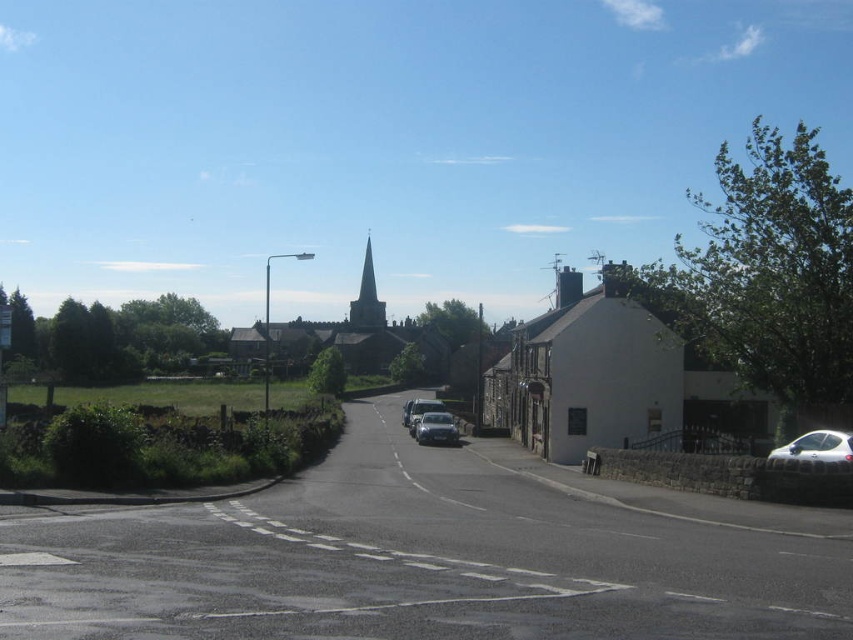
Question: Which of the following is the closest to the observer?

Choices:
 (A) white stone church at center
 (B) gray stone church steeple at center
 (C) white stone spire at center
 (D) white glossy car at lower right

Answer: (D)

Question: Which of the following is the farthest from the observer?

Choices:
 (A) (839, 449)
 (B) (374, 296)
 (C) (328, 342)

Answer: (B)

Question: Is white stone spire at center to the left of metallic silver car at center from the viewer's perspective?

Choices:
 (A) yes
 (B) no

Answer: (A)

Question: Estimate the real-world distances between objects in this image. Which object is farther from the metallic silver car at center?

Choices:
 (A) white plastic street sign at left
 (B) shiny silver car at center
 (C) white glossy car at lower right
 (D) gray stone church steeple at center

Answer: (D)

Question: Where is gray stone church steeple at center located in relation to shiny silver car at center in the image?

Choices:
 (A) left
 (B) right

Answer: (A)

Question: Is white stone church at center bigger than white stone spire at center?

Choices:
 (A) no
 (B) yes

Answer: (A)